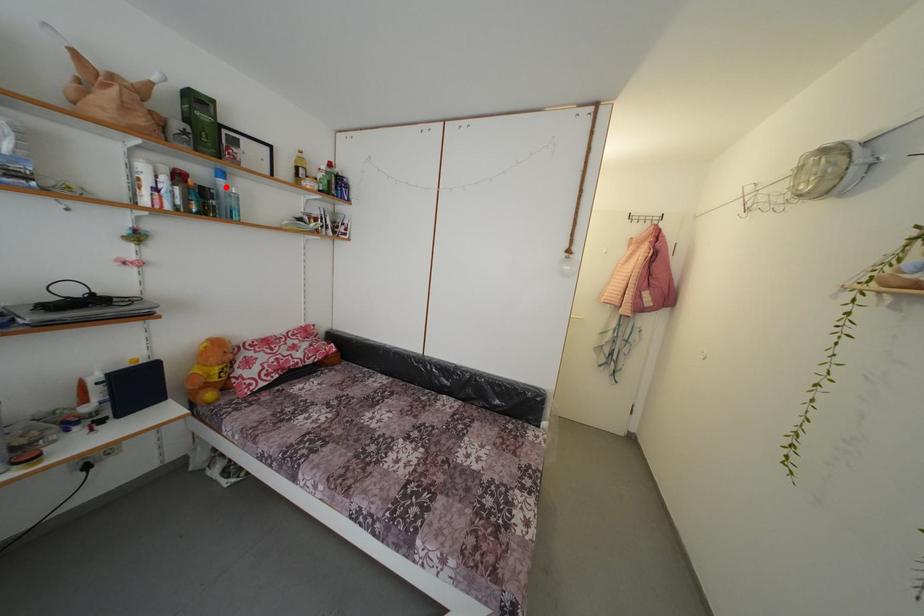
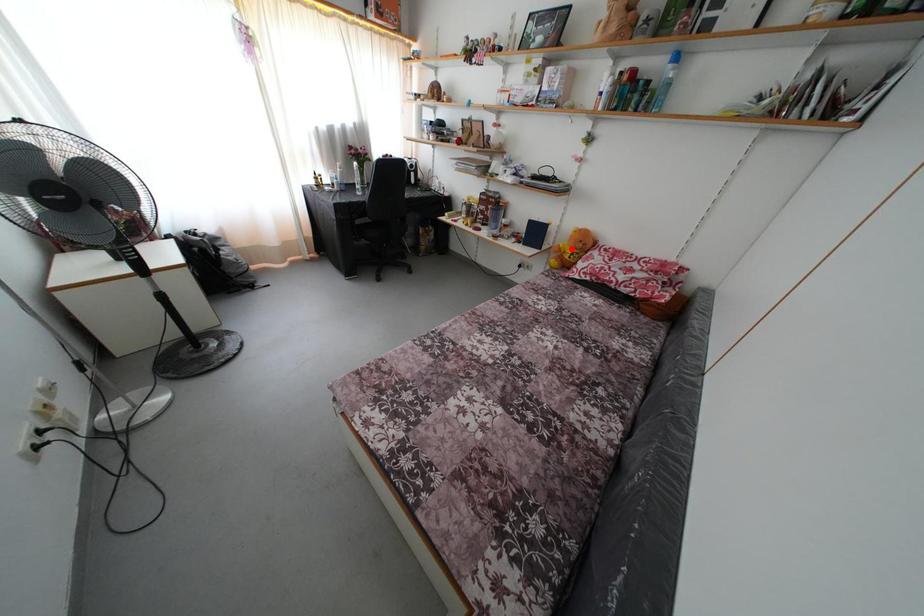
I am providing you with two images of the same scene from different viewpoints. A red point is marked on the first image and another point is marked on the second image. Do the highlighted points in image1 and image2 indicate the same real-world spot?

No